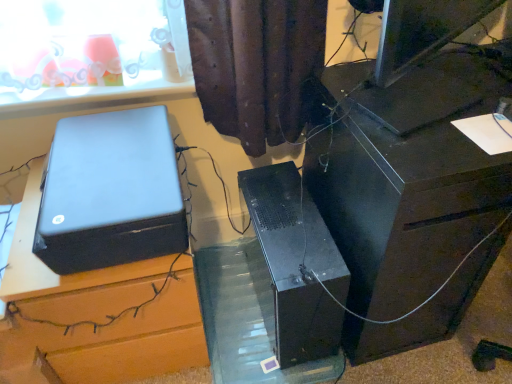
Question: Is black matte computer tower at center at the right side of satin black printer at left?

Choices:
 (A) no
 (B) yes

Answer: (B)

Question: Can you confirm if black matte computer tower at center is shorter than satin black printer at left?

Choices:
 (A) yes
 (B) no

Answer: (B)

Question: Is black matte computer tower at center wider than satin black printer at left?

Choices:
 (A) no
 (B) yes

Answer: (B)

Question: Does black matte computer tower at center appear on the left side of satin black printer at left?

Choices:
 (A) no
 (B) yes

Answer: (A)

Question: Would you consider black matte computer tower at center to be distant from satin black printer at left?

Choices:
 (A) yes
 (B) no

Answer: (B)

Question: From the image's perspective, is black matte computer tower at center beneath satin black printer at left?

Choices:
 (A) yes
 (B) no

Answer: (A)

Question: From the image's perspective, is black plastic desk at right, which is counted as the second furniture, starting from the left, under black matte computer tower at center?

Choices:
 (A) yes
 (B) no

Answer: (B)

Question: Can you confirm if black plastic desk at right, which is counted as the second furniture, starting from the left, is bigger than black matte computer tower at center?

Choices:
 (A) yes
 (B) no

Answer: (A)

Question: Is black plastic desk at right, which is counted as the second furniture, starting from the left, taller than black matte computer tower at center?

Choices:
 (A) no
 (B) yes

Answer: (B)

Question: Is black plastic desk at right, which is counted as the second furniture, starting from the left, next to black matte computer tower at center and touching it?

Choices:
 (A) yes
 (B) no

Answer: (B)

Question: From a real-world perspective, is black plastic desk at right, which is counted as the second furniture, starting from the left, physically below black matte computer tower at center?

Choices:
 (A) yes
 (B) no

Answer: (B)

Question: Considering the relative positions of black plastic desk at right, positioned as the 1th furniture in right-to-left order, and black matte computer tower at center in the image provided, is black plastic desk at right, positioned as the 1th furniture in right-to-left order, to the left of black matte computer tower at center from the viewer's perspective?

Choices:
 (A) no
 (B) yes

Answer: (A)

Question: Are satin black printer at left and transparent plastic glass table at center far apart?

Choices:
 (A) yes
 (B) no

Answer: (B)